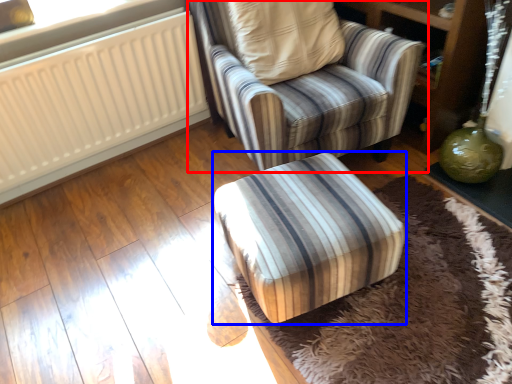
Question: Which object is closer to the camera taking this photo, chair (highlighted by a red box) or furniture (highlighted by a blue box)?

Choices:
 (A) chair
 (B) furniture

Answer: (B)